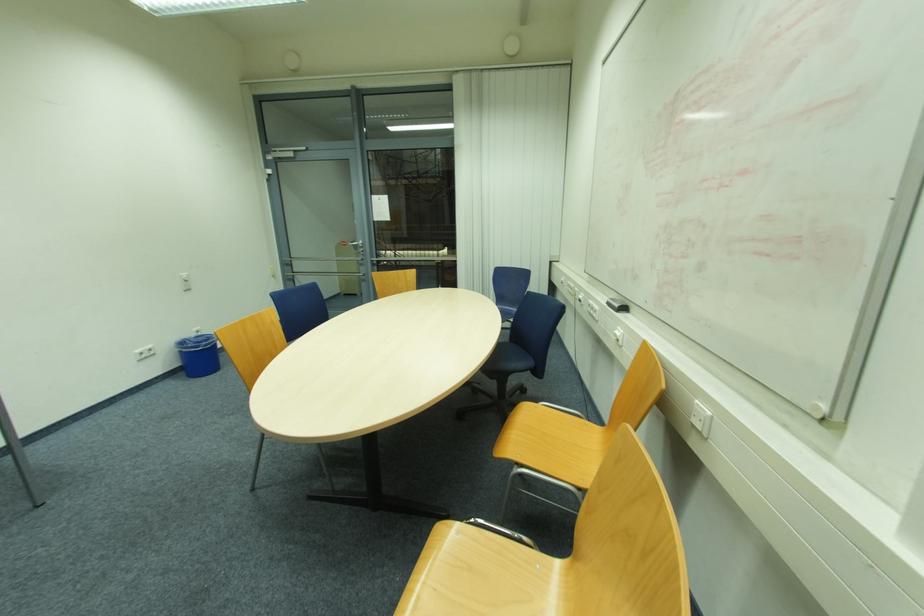
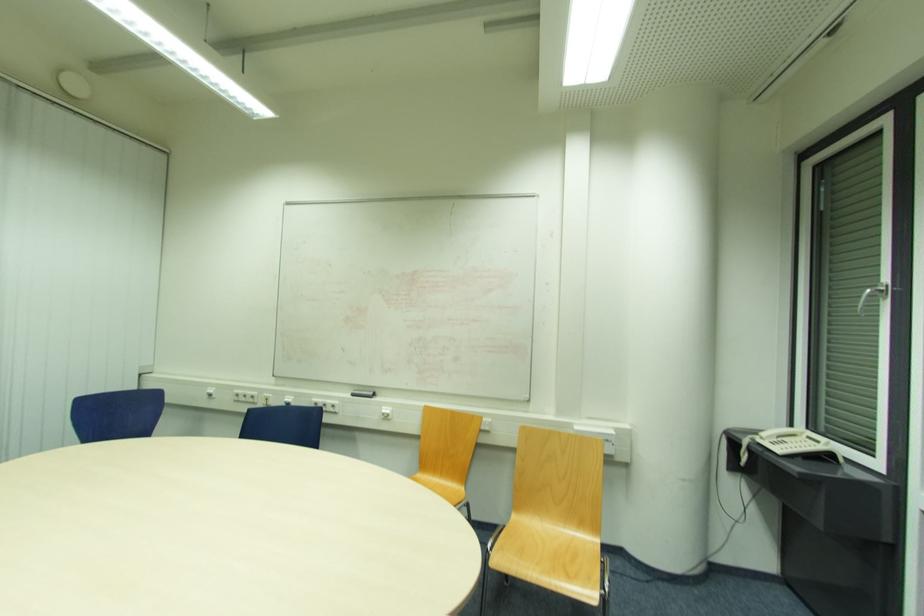
Find the pixel in the second image that matches (611,305) in the first image.

(355, 395)